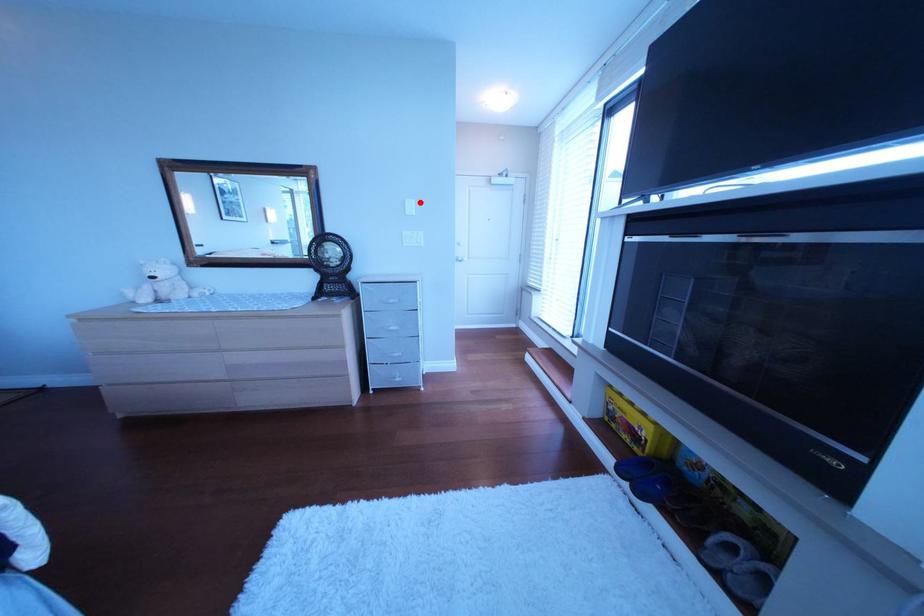
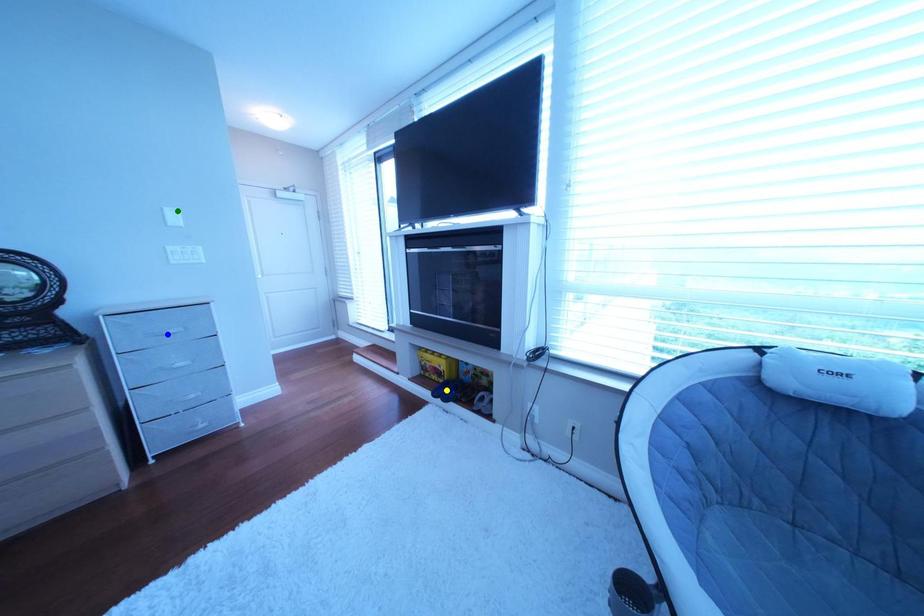
Question: I am providing you with two images of the same scene from different viewpoints. A red point is marked on the first image. You are given multiple points on the second image. Which point in image 2 is actually the same real-world point as the red point in image 1?

Choices:
 (A) blue point
 (B) yellow point
 (C) green point

Answer: (C)